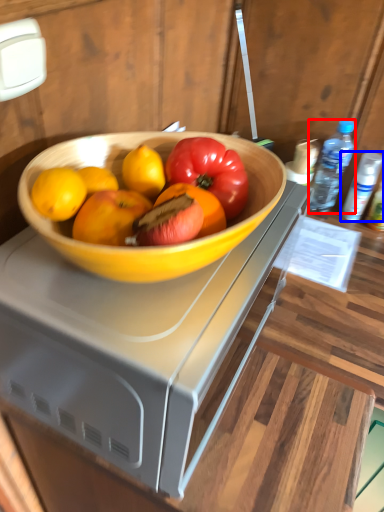
Question: Which point is closer to the camera, bottle (highlighted by a red box) or bottle (highlighted by a blue box)?

Choices:
 (A) bottle
 (B) bottle

Answer: (A)